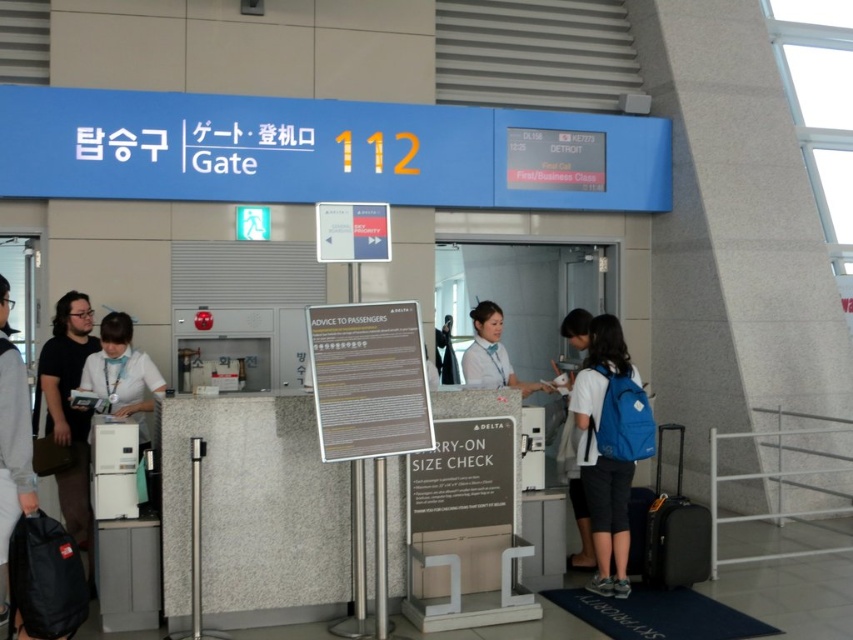
From the picture: You are a passenger at Gate 112 and need to place your black fabric backpack at lower left and white cotton shirt at left into a small overhead compartment. Which item should you place first to ensure both fit?

The black fabric backpack at lower left is smaller than the white cotton shirt at left, so you should place the white cotton shirt at left first to make space for the smaller backpack.

Looking at this image, you are standing at the airport gate and want to know which point is closer to you between point (67,420) and point (32,493). Based on the scene, can you determine which one is closer?

Point (67,420) is further to the viewer than point (32,493), so the closer point is point (32,493).